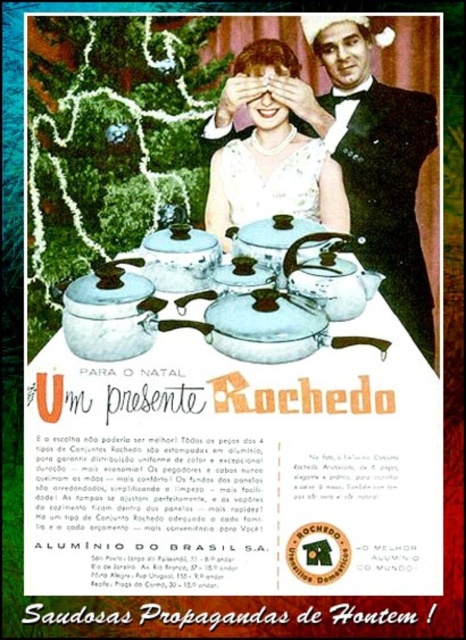
Question: Which point appears closest to the camera in this image?

Choices:
 (A) (363, 248)
 (B) (266, 253)

Answer: (B)

Question: Among these points, which one is nearest to the camera?

Choices:
 (A) (267, 236)
 (B) (297, 90)
 (C) (334, 246)
 (D) (356, 99)

Answer: (C)

Question: Is matte white dress at center in front of matte blue teapot at center?

Choices:
 (A) yes
 (B) no

Answer: (B)

Question: Can you confirm if matte white dress at center is positioned above matte aluminum tea pot at center?

Choices:
 (A) yes
 (B) no

Answer: (A)

Question: Which object is positioned closest to the matte white dress at center?

Choices:
 (A) matte blue teapot at center
 (B) black velvet suit at right

Answer: (B)

Question: Is matte aluminum tea pot at center closer to camera compared to matte blue teapot at center?

Choices:
 (A) yes
 (B) no

Answer: (A)